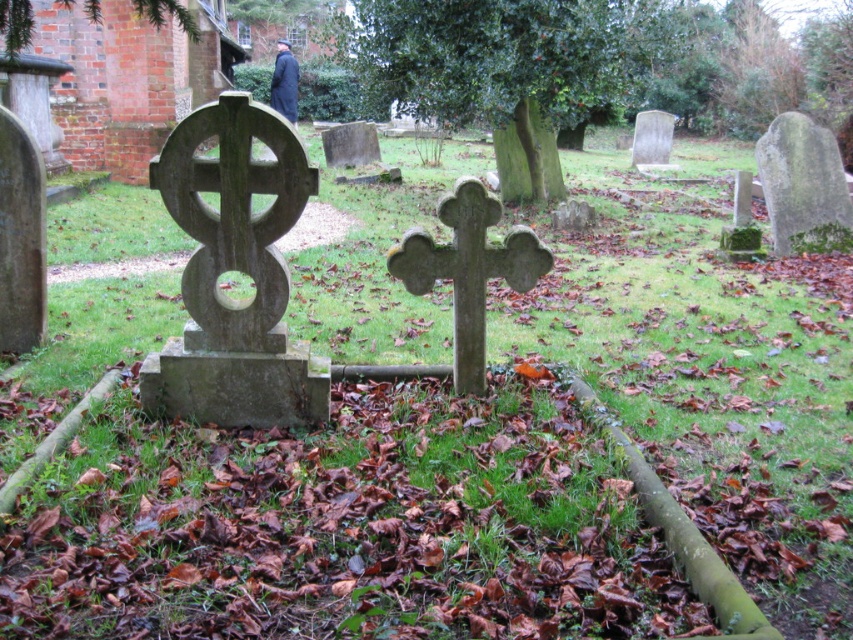
Question: Estimate the real-world distances between objects in this image. Which object is farther from the green stone cross at center?

Choices:
 (A) dark wool coat at upper center
 (B) dark gray stone cross at center

Answer: (A)

Question: Is green stone cross at center wider than smooth gray stone cross at center?

Choices:
 (A) no
 (B) yes

Answer: (A)

Question: From the image, what is the correct spatial relationship of green stone cross at center in relation to dark wool coat at upper center?

Choices:
 (A) below
 (B) above

Answer: (A)

Question: Among these objects, which one is farthest from the camera?

Choices:
 (A) dark gray stone cross at center
 (B) dark wool coat at upper center
 (C) smooth gray stone cross at center

Answer: (B)

Question: Does dark gray stone cross at center appear on the right side of smooth gray stone cross at center?

Choices:
 (A) no
 (B) yes

Answer: (B)

Question: Which of the following is the closest to the observer?

Choices:
 (A) dark wool coat at upper center
 (B) green stone cross at center
 (C) smooth gray stone cross at center

Answer: (B)